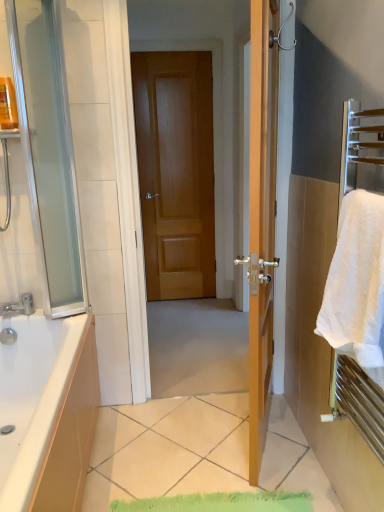
The width and height of the screenshot is (384, 512). I want to click on free space above wooden door at center (from a real-world perspective), so click(x=174, y=40).